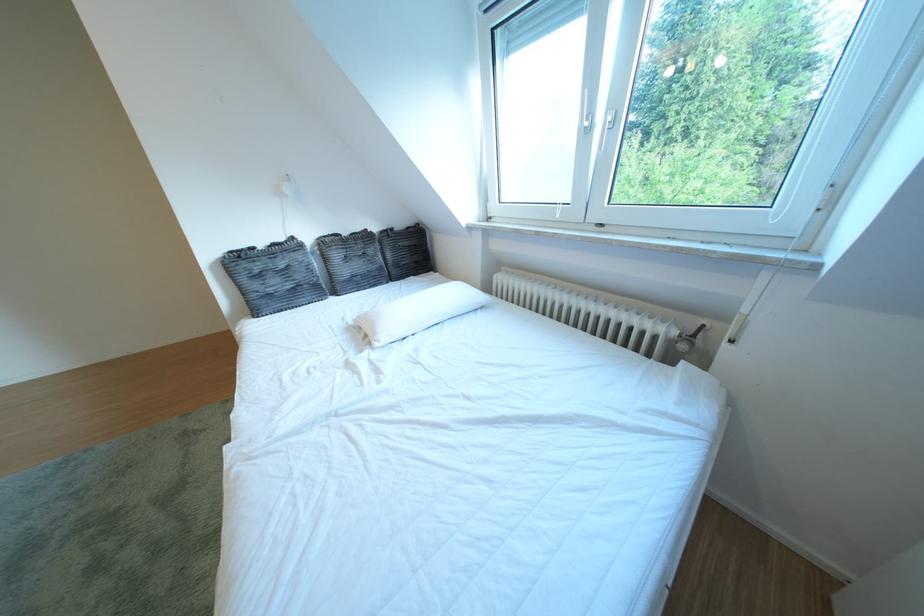
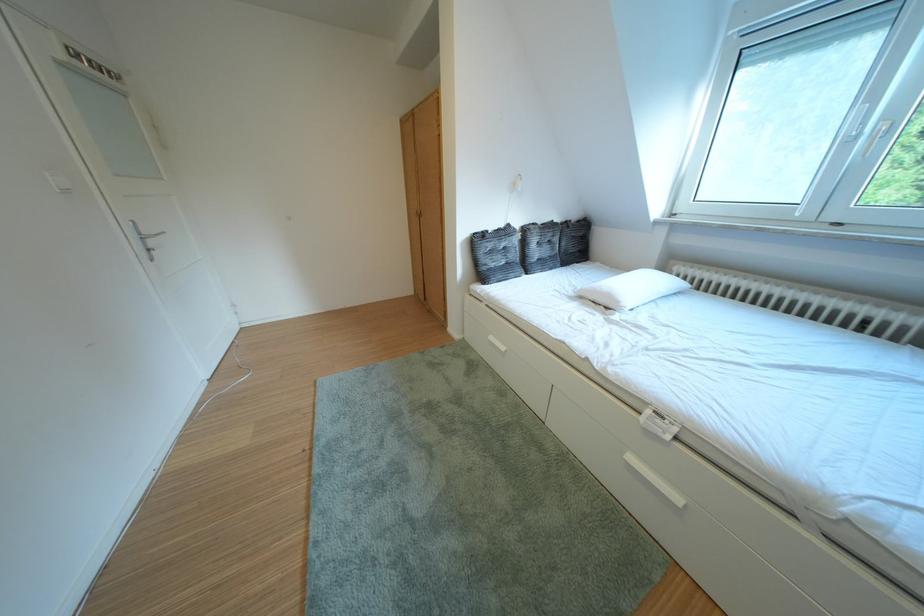
In a continuous first-person perspective shot, in which direction is the camera moving?

The cameraman walked toward left, backward.